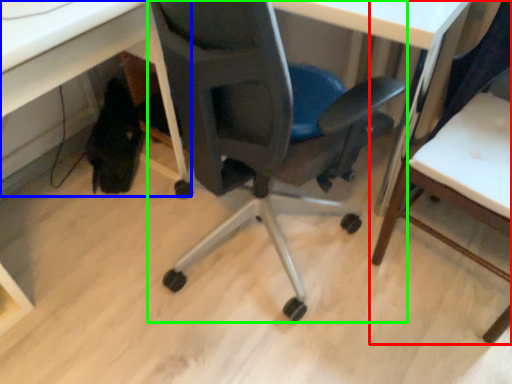
Question: Considering the real-world distances, which object is farthest from chair (highlighted by a red box)? computer desk (highlighted by a blue box) or chair (highlighted by a green box)?

Choices:
 (A) computer desk
 (B) chair

Answer: (A)